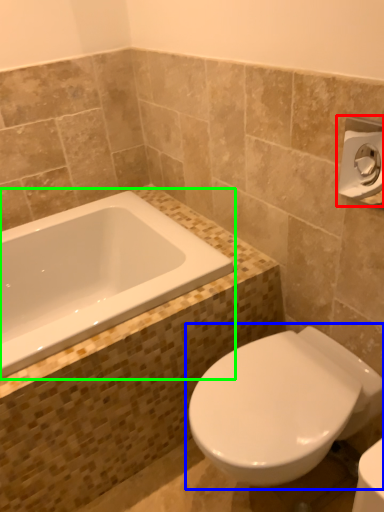
Question: Considering the real-world distances, which object is farthest from towel bar (highlighted by a red box)? toilet (highlighted by a blue box) or bathtub (highlighted by a green box)?

Choices:
 (A) toilet
 (B) bathtub

Answer: (B)